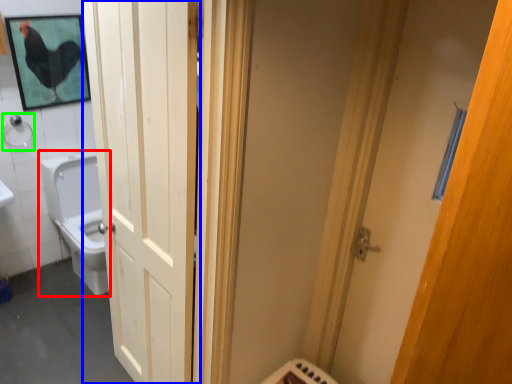
Question: Which object is positioned closest to toilet (highlighted by a red box)? Select from door (highlighted by a blue box) and shower (highlighted by a green box).

Choices:
 (A) door
 (B) shower

Answer: (B)